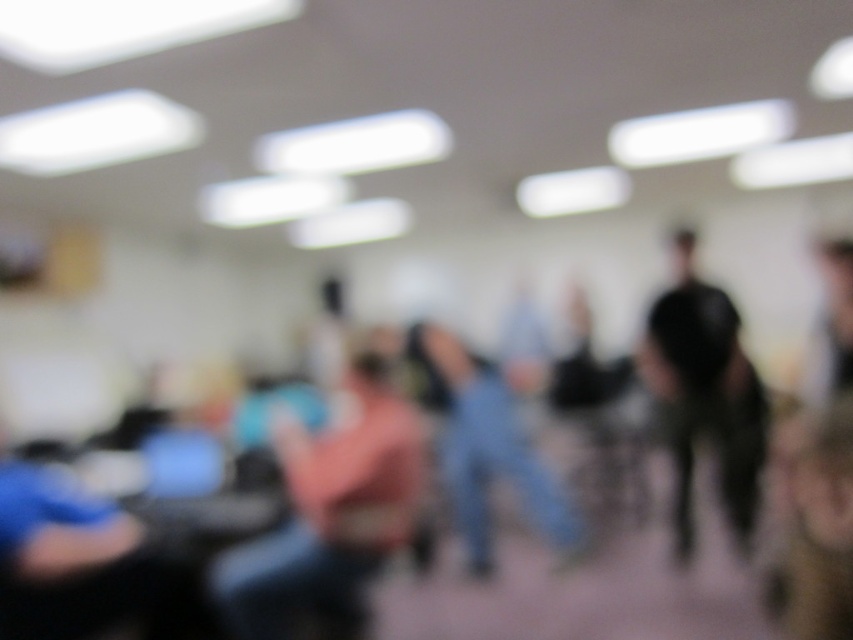
I want to click on blue fabric shirt at lower left, so click(x=80, y=566).

Who is positioned more to the right, blue fabric shirt at lower left or dark gray fabric jacket at right?

dark gray fabric jacket at right is more to the right.

Which is behind, point (68, 548) or point (683, 384)?

Positioned behind is point (683, 384).

Where is `blue fabric shirt at lower left`? The height and width of the screenshot is (640, 853). blue fabric shirt at lower left is located at coordinates (80, 566).

Does dark gray fabric jacket at right appear over brown leather jacket at lower right?

Yes.

Where is `dark gray fabric jacket at right`? The image size is (853, 640). dark gray fabric jacket at right is located at coordinates (705, 394).

Where is `dark gray fabric jacket at right`? Image resolution: width=853 pixels, height=640 pixels. dark gray fabric jacket at right is located at coordinates (705, 394).

Which is in front, point (154, 596) or point (572, 520)?

Point (154, 596) is more forward.

Does blue fabric shirt at lower left have a larger size compared to denim jeans at center?

No.

Is point (169, 596) positioned behind point (450, 432)?

No.

Locate an element on the screen. The width and height of the screenshot is (853, 640). blue fabric shirt at lower left is located at coordinates (80, 566).